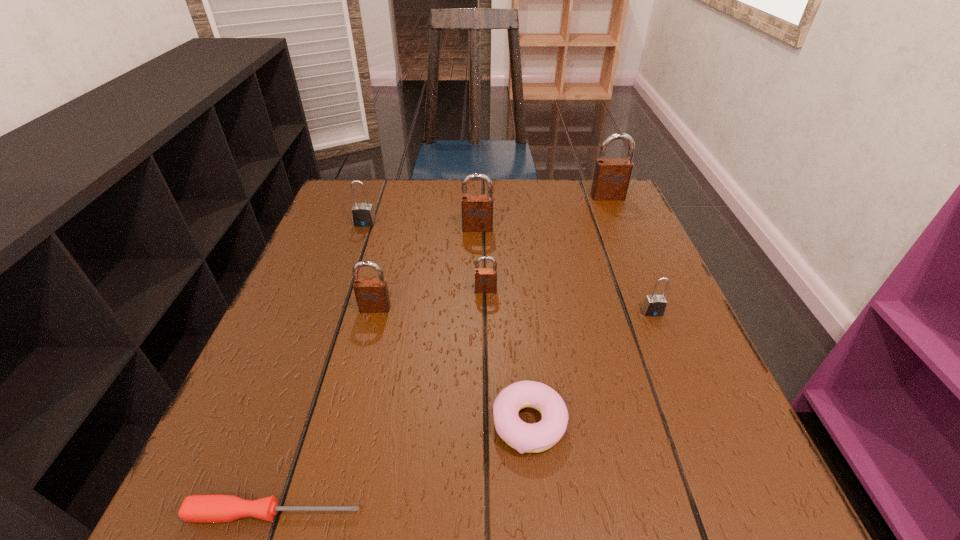
This screenshot has height=540, width=960. I want to click on the fifth nearest object, so click(485, 278).

At what (x,y) coordinates should I click in order to perform the action: click on the third nearest padlock. Please return your answer as a coordinate pair (x, y). Image resolution: width=960 pixels, height=540 pixels. Looking at the image, I should click on click(x=485, y=278).

Image resolution: width=960 pixels, height=540 pixels. What are the coordinates of `pink doughnut` in the screenshot? It's located at (524, 437).

Where is `the seventh farthest object`? The image size is (960, 540). the seventh farthest object is located at coordinates (524, 437).

At what (x,y) coordinates should I click in order to perform the action: click on the nearest object. Please return your answer as a coordinate pair (x, y). The image size is (960, 540). Looking at the image, I should click on (218, 508).

Identify the location of screwdriver. Image resolution: width=960 pixels, height=540 pixels. (218, 508).

Locate an element on the screen. free region located 0.390m on the front-facing side of the rightmost brown padlock is located at coordinates (652, 301).

This screenshot has height=540, width=960. What are the coordinates of `free space located 0.090m on the front-facing side of the fifth shortest padlock` in the screenshot? It's located at (477, 255).

This screenshot has height=540, width=960. I want to click on free region located 0.320m on the shackle of the leftmost padlock, so click(x=330, y=321).

Where is `vacant region located 0.250m on the front-facing side of the second padlock from left to right`? This screenshot has height=540, width=960. vacant region located 0.250m on the front-facing side of the second padlock from left to right is located at coordinates (345, 429).